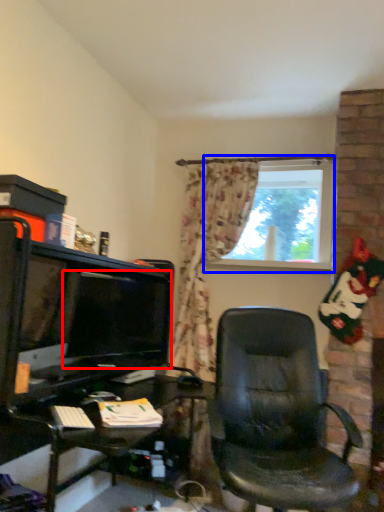
Question: Which of the following is the farthest to the observer, computer monitor (highlighted by a red box) or window (highlighted by a blue box)?

Choices:
 (A) computer monitor
 (B) window

Answer: (B)